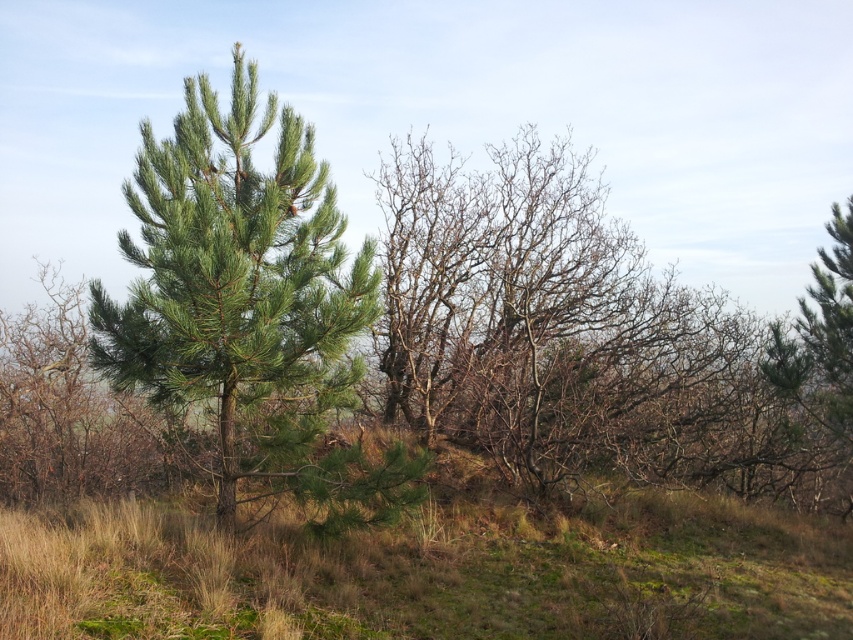
Is bare branches at center thinner than green needle-like at right?

Indeed, bare branches at center has a lesser width compared to green needle-like at right.

Does bare branches at center have a smaller size compared to green needle-like at right?

Correct, bare branches at center occupies less space than green needle-like at right.

The image size is (853, 640). In order to click on bare branches at center in this screenshot , I will do `click(566, 333)`.

Which is behind, point (445, 397) or point (308, 429)?

Positioned behind is point (445, 397).

Is point (468, 316) positioned before point (277, 385)?

No, (468, 316) is further to viewer.

You are a GUI agent. You are given a task and a screenshot of the screen. Output one action in this format:
    pyautogui.click(x=<x>, y=<y>)
    Task: Click on the bare branches at center
    
    Given the screenshot: What is the action you would take?
    pyautogui.click(x=566, y=333)

Measure the distance from green needle-like at center to green needle-like at right.

A distance of 7.44 meters exists between green needle-like at center and green needle-like at right.

Who is more distant from viewer, (280, 324) or (849, 248)?

Point (849, 248)

Identify the location of green needle-like at center. This screenshot has height=640, width=853. (248, 305).